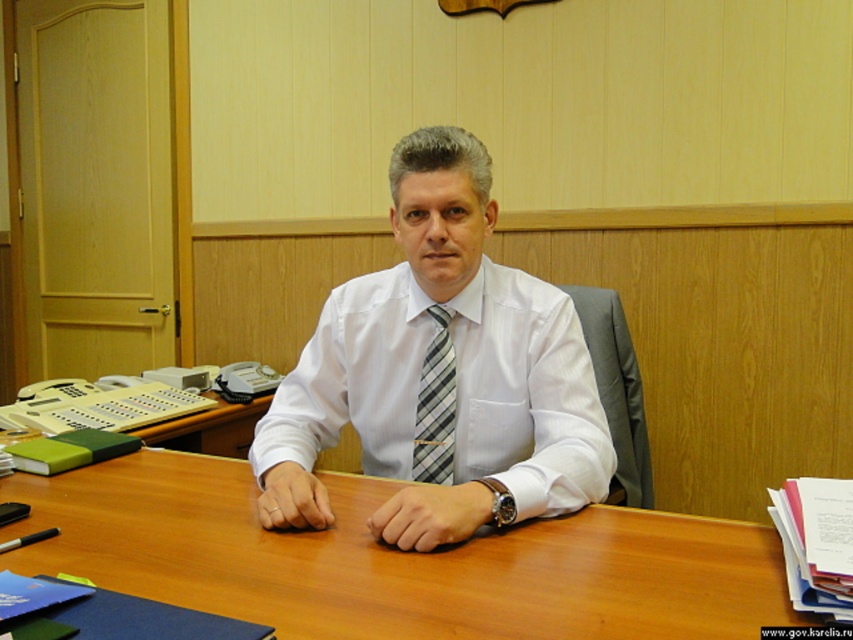
Is wooden at center in front of gray striped tie at center?

Yes.

Is point (642, 528) positioned after point (434, 422)?

That is False.

Where is `wooden at center`? wooden at center is located at coordinates (395, 561).

Which is below, white striped tie at center or gray striped tie at center?

gray striped tie at center

You are a GUI agent. You are given a task and a screenshot of the screen. Output one action in this format:
    pyautogui.click(x=<x>, y=<y>)
    Task: Click on the white striped tie at center
    
    Given the screenshot: What is the action you would take?
    coord(440,374)

Does wooden at center have a greater height compared to white striped tie at center?

Incorrect, wooden at center's height is not larger of white striped tie at center's.

Locate an element on the screen. The height and width of the screenshot is (640, 853). wooden at center is located at coordinates (395, 561).